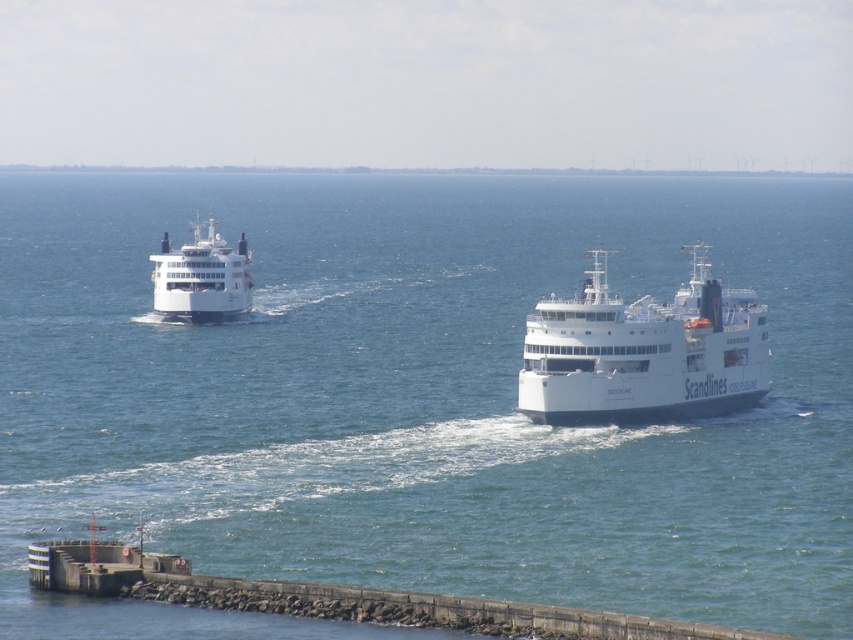
Is blue water at center bigger than white matte ferry at left?

Yes.

Between blue water at center and white matte ferry at left, which one appears on the left side from the viewer's perspective?

white matte ferry at left is more to the left.

Locate an element on the screen. The image size is (853, 640). blue water at center is located at coordinates (416, 397).

Does blue water at center appear under white matte ferry at center?

Actually, blue water at center is above white matte ferry at center.

Does blue water at center have a smaller size compared to white matte ferry at center?

Actually, blue water at center might be larger than white matte ferry at center.

Find the location of a particular element. blue water at center is located at coordinates (416, 397).

This screenshot has width=853, height=640. Identify the location of white matte ferry at center. (643, 353).

Does white matte ferry at center have a lesser width compared to white matte ferry at left?

No.

This screenshot has height=640, width=853. What do you see at coordinates (643, 353) in the screenshot?
I see `white matte ferry at center` at bounding box center [643, 353].

Identify the location of white matte ferry at center. The width and height of the screenshot is (853, 640). (643, 353).